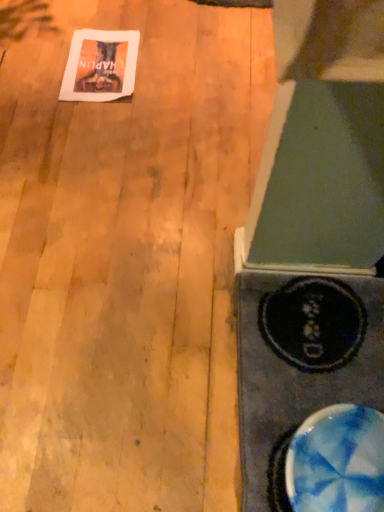
Identify the location of vacant space to the right of white paper at upper left. point(173,69).